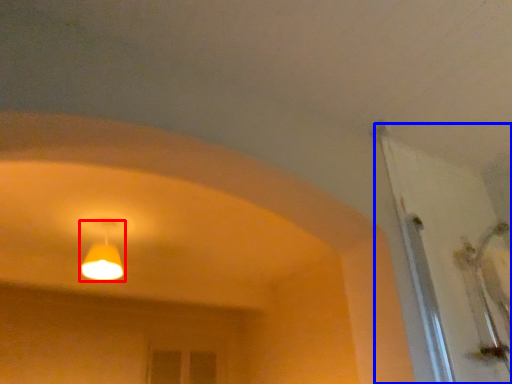
Question: Which object appears farthest to the camera in this image, lamp (highlighted by a red box) or door (highlighted by a blue box)?

Choices:
 (A) lamp
 (B) door

Answer: (A)